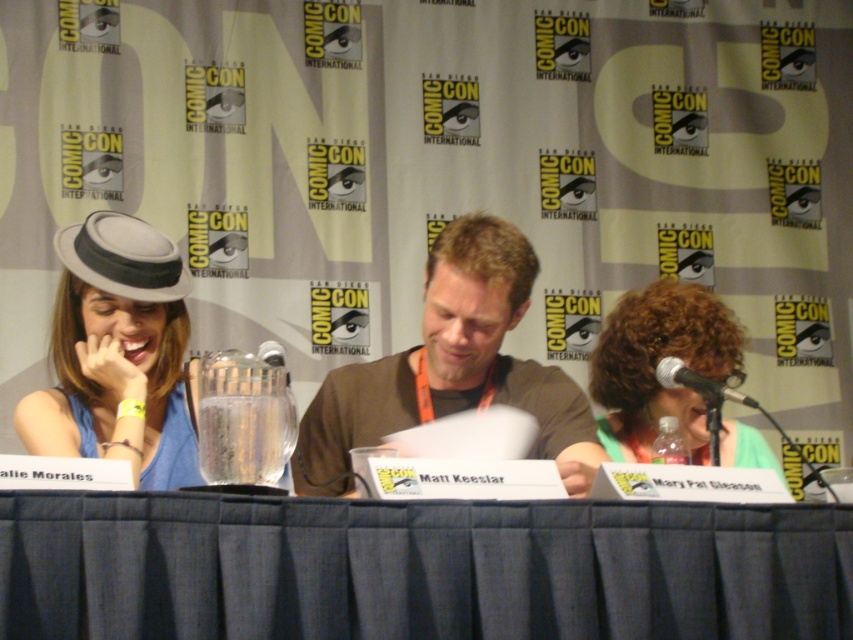
You are a photographer setting up for a photo shoot at the Comic Con panel. You need to position a light source between the matte gray hat at left and the black metallic microphone at right. Based on their widths, which object should the light be closer to?

The matte gray hat at left might be wider than black metallic microphone at right, so the light should be positioned closer to the matte gray hat at left to ensure even lighting across both objects.

You are a photographer at Comic Con and need to take a photo of the curly hair at center and the black metallic microphone at right. Which object should you zoom in on to ensure both are in focus?

The curly hair at center has a larger size compared to the black metallic microphone at right, so you should focus on the curly hair at center to ensure both are in focus.

You are a photographer at Comic Con and need to capture a photo of the matte gray hat at left and the black metallic microphone at right. Based on their positions, which object is closer to the left edge of the frame?

The matte gray hat at left is closer to the left edge of the frame because it is positioned on the left side of the black metallic microphone at right.